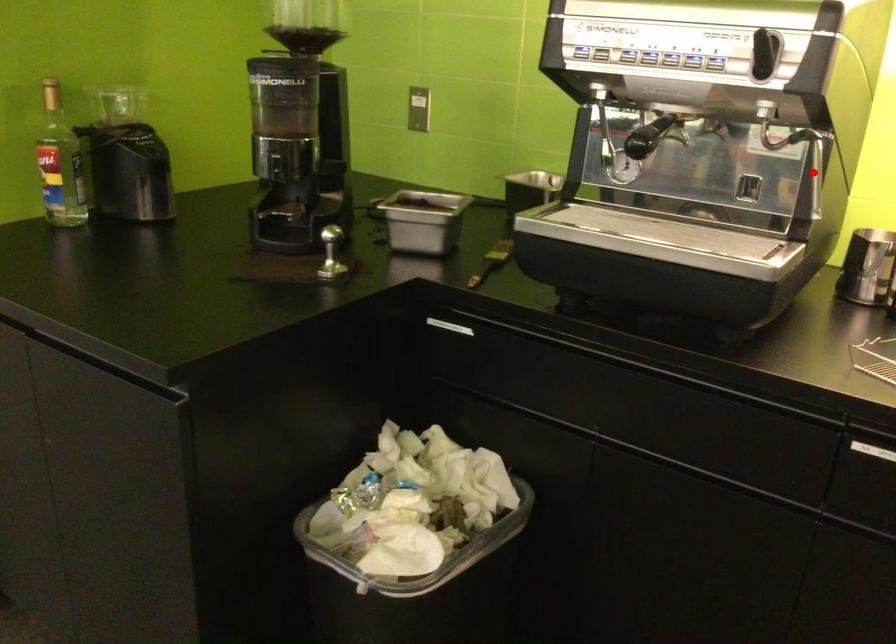
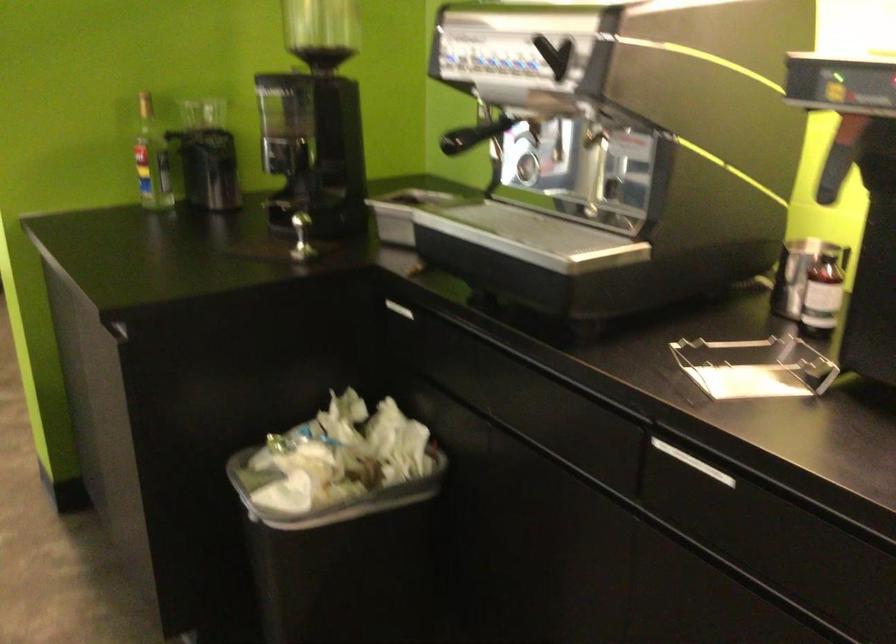
Question: I am providing you with two images of the same scene from different viewpoints. A red point is marked on the first image. At the location where the point appears in image 1, is it still visible in image 2?

Choices:
 (A) Yes
 (B) No

Answer: (A)